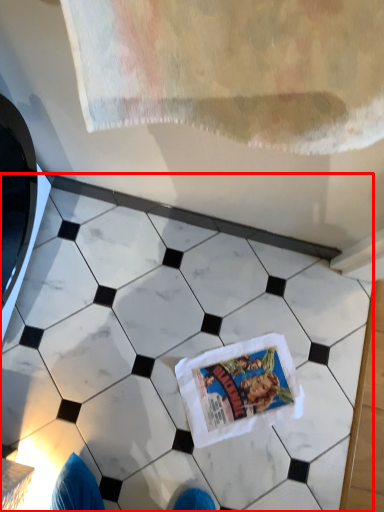
Question: Observing the image, what is the correct spatial positioning of marble (annotated by the red box) in reference to comic book?

Choices:
 (A) left
 (B) right

Answer: (A)